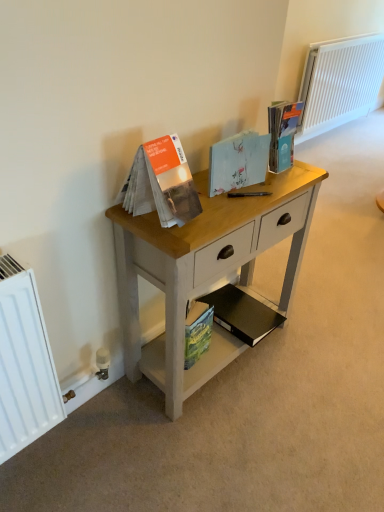
Question: Is white painted radiator at upper right in front of or behind light wood desk at center in the image?

Choices:
 (A) front
 (B) behind

Answer: (B)

Question: Is white painted radiator at upper right wider or thinner than light wood desk at center?

Choices:
 (A) thin
 (B) wide

Answer: (A)

Question: Considering the real-world distances, which object is closest to the light wood desk at center?

Choices:
 (A) black matte book at lower center, which is the 2th paperback book from bottom to top
 (B) green matte paperback book at lower center, which appears as the 1th paperback book when ordered from the bottom
 (C) white painted radiator at upper right
 (D) light blue paper at center, the 2th paperback book positioned from the top
 (E) matte blue paperback book at upper right, the 4th paperback book when ordered from bottom to top

Answer: (B)

Question: Which object is the farthest from the green matte paperback book at lower center, which appears as the 1th paperback book when ordered from the bottom?

Choices:
 (A) light wood desk at center
 (B) white painted radiator at upper right
 (C) black matte book at lower center, which is the 2th paperback book from bottom to top
 (D) matte blue paperback book at upper right, the 1th paperback book viewed from the top
 (E) light blue paper at center, the 2th paperback book positioned from the top

Answer: (B)